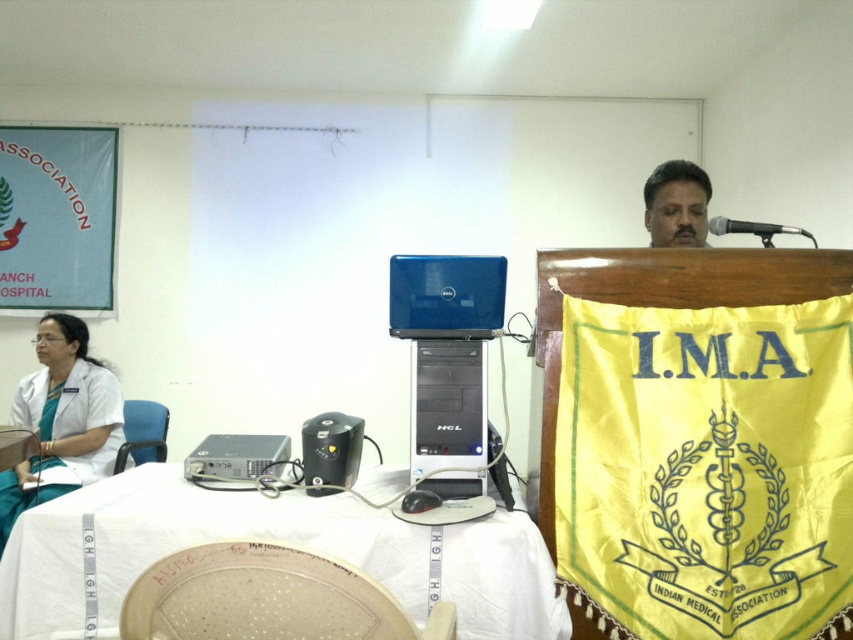
Question: Is the position of black plastic speaker at center more distant than that of metallic at upper right?

Choices:
 (A) yes
 (B) no

Answer: (B)

Question: Which point appears farthest from the camera in this image?

Choices:
 (A) (689, 221)
 (B) (22, 464)
 (C) (479, 557)
 (D) (305, 424)

Answer: (B)

Question: Considering the relative positions of white cloth at left and black plastic speaker at center in the image provided, where is white cloth at left located with respect to black plastic speaker at center?

Choices:
 (A) above
 (B) below

Answer: (B)

Question: Does white plastic table at center appear over white cloth at left?

Choices:
 (A) yes
 (B) no

Answer: (B)

Question: Based on their relative distances, which object is nearer to the white plastic table at center?

Choices:
 (A) black plastic speaker at center
 (B) matte black laptop at upper center
 (C) metallic at upper right
 (D) white cloth at left

Answer: (A)

Question: Among these points, which one is nearest to the camera?

Choices:
 (A) (769, 227)
 (B) (112, 376)

Answer: (A)